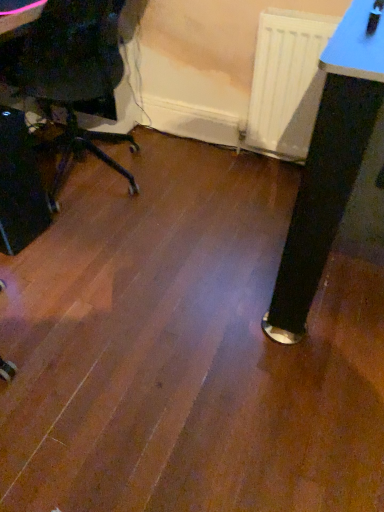
Locate an element on the screen. The height and width of the screenshot is (512, 384). free space between black plastic computer tower at left and white matte radiator at center is located at coordinates (161, 203).